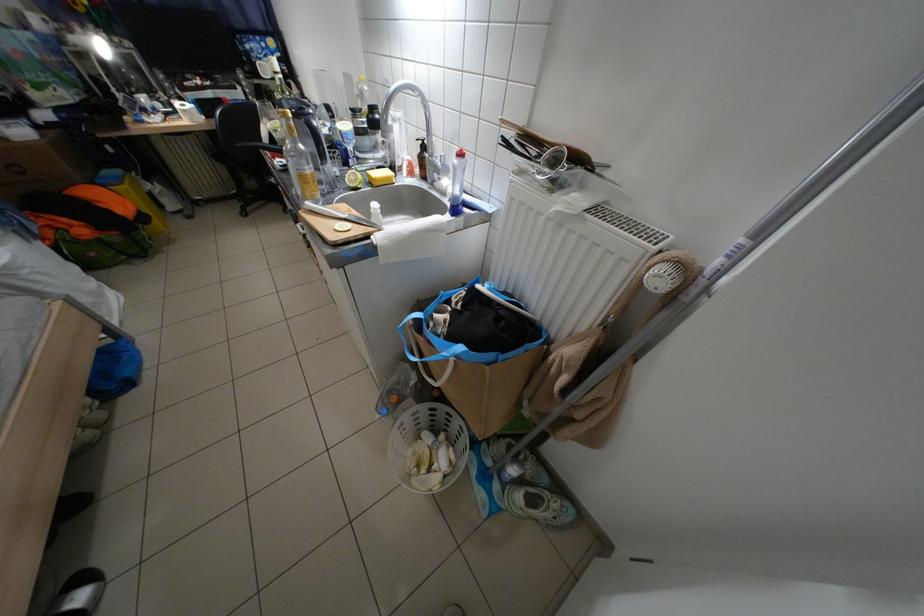
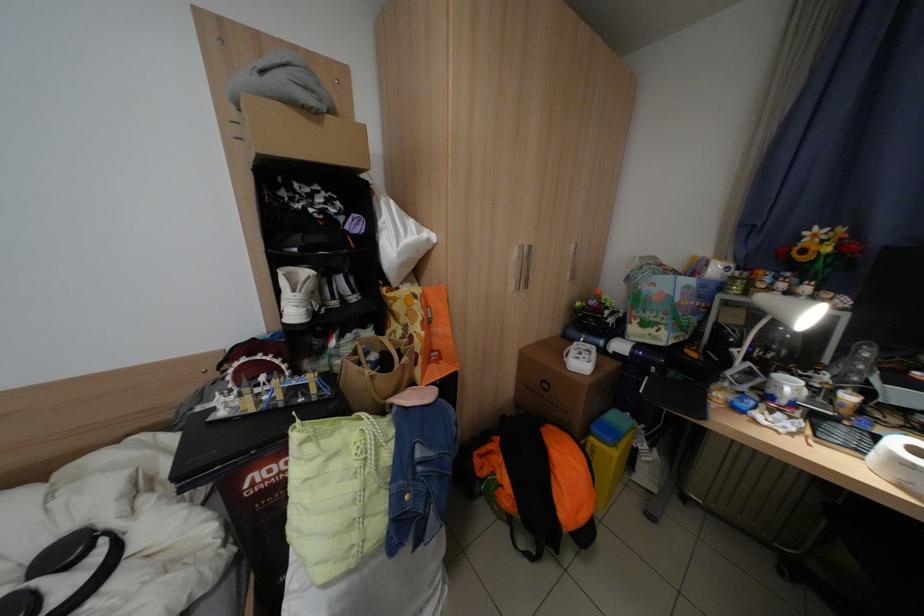
In the second image, find the point that corresponds to (x=155, y=100) in the first image.

(800, 387)